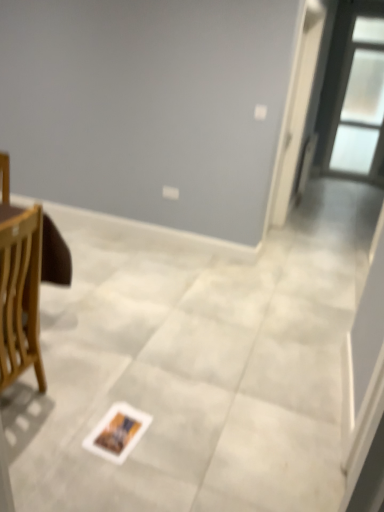
Question: From a real-world perspective, is white paper postcard at center physically located above or below transparent glass window at upper right?

Choices:
 (A) above
 (B) below

Answer: (B)

Question: In terms of height, does white paper postcard at center look taller or shorter compared to transparent glass window at upper right?

Choices:
 (A) short
 (B) tall

Answer: (A)

Question: Which object is positioned farthest from the transparent glass window at upper right?

Choices:
 (A) white paper postcard at center
 (B) white glossy screen door at upper right

Answer: (A)

Question: Estimate the real-world distances between objects in this image. Which object is closer to the white paper postcard at center?

Choices:
 (A) transparent glass window at upper right
 (B) white glossy screen door at upper right

Answer: (B)